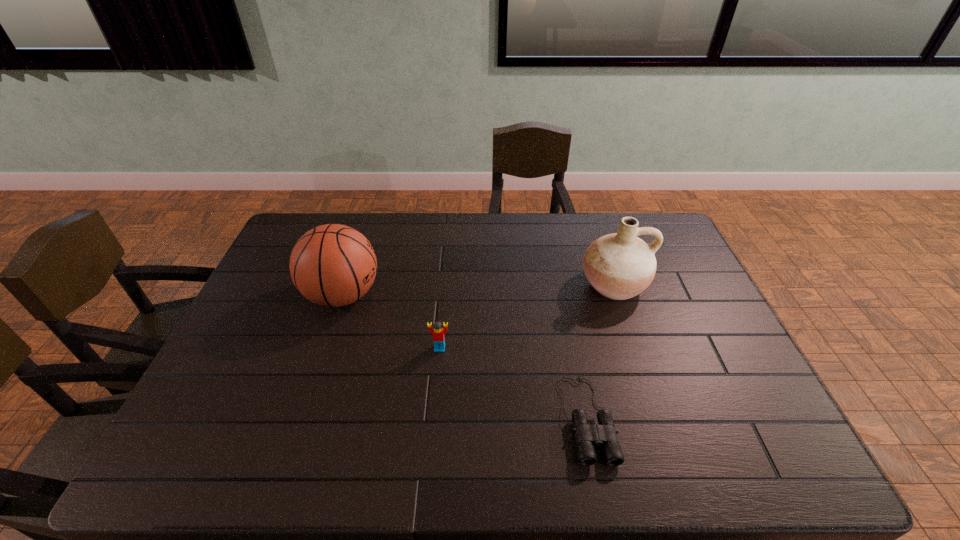
You are a GUI agent. You are given a task and a screenshot of the screen. Output one action in this format:
    pyautogui.click(x=<x>, y=<y>)
    Task: Click on the free spot that satisfies the following two spatial constraints: 1. to pour from the handle of the rightmost object; 2. on the surface of the basketball near the brand logo
    
    Given the screenshot: What is the action you would take?
    (x=617, y=295)

Find the location of a particular element. This screenshot has width=960, height=540. vacant space that satisfies the following two spatial constraints: 1. to pour from the handle of the pottery; 2. on the surface of the basketball near the brand logo is located at coordinates (617, 295).

Locate an element on the screen. The width and height of the screenshot is (960, 540). free region that satisfies the following two spatial constraints: 1. to pour from the handle of the pottery; 2. on the surface of the leftmost object near the brand logo is located at coordinates (617, 295).